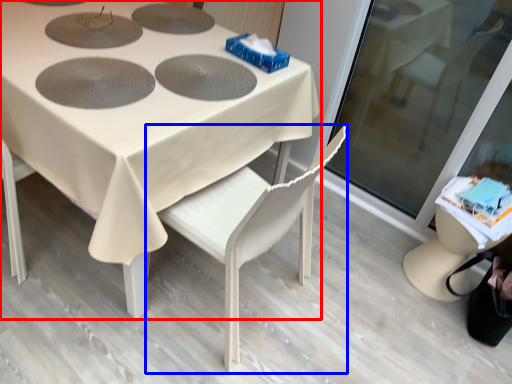
Question: Among these objects, which one is farthest to the camera, table (highlighted by a red box) or chair (highlighted by a blue box)?

Choices:
 (A) table
 (B) chair

Answer: (B)